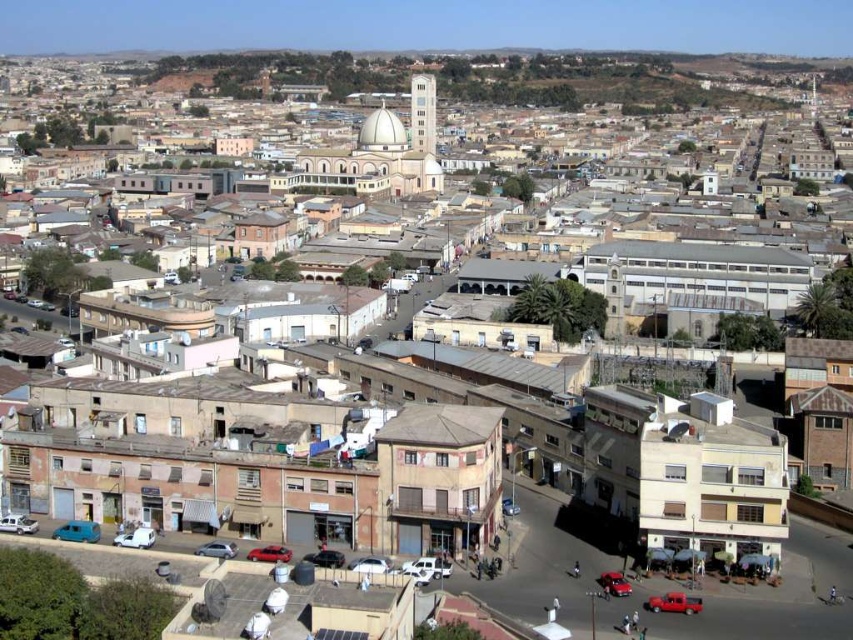
Question: Which object is closer to the camera taking this photo?

Choices:
 (A) silver metallic car at center
 (B) metallic red car at center
 (C) white matte car at lower left

Answer: (A)

Question: Is white matte van at lower left to the left of white matte car at center from the viewer's perspective?

Choices:
 (A) no
 (B) yes

Answer: (B)

Question: Which point is closer to the camera?

Choices:
 (A) (264, 557)
 (B) (695, 600)
 (C) (367, 570)

Answer: (B)

Question: In this image, where is shiny red car at center located relative to silver metallic car at center?

Choices:
 (A) above
 (B) below

Answer: (B)

Question: Is white matte van at lower left positioned before shiny red car at center?

Choices:
 (A) yes
 (B) no

Answer: (B)

Question: Which object is farther from the camera taking this photo?

Choices:
 (A) metallic red car at center
 (B) matte black car at center
 (C) shiny red car at center
 (D) white matte car at center

Answer: (A)